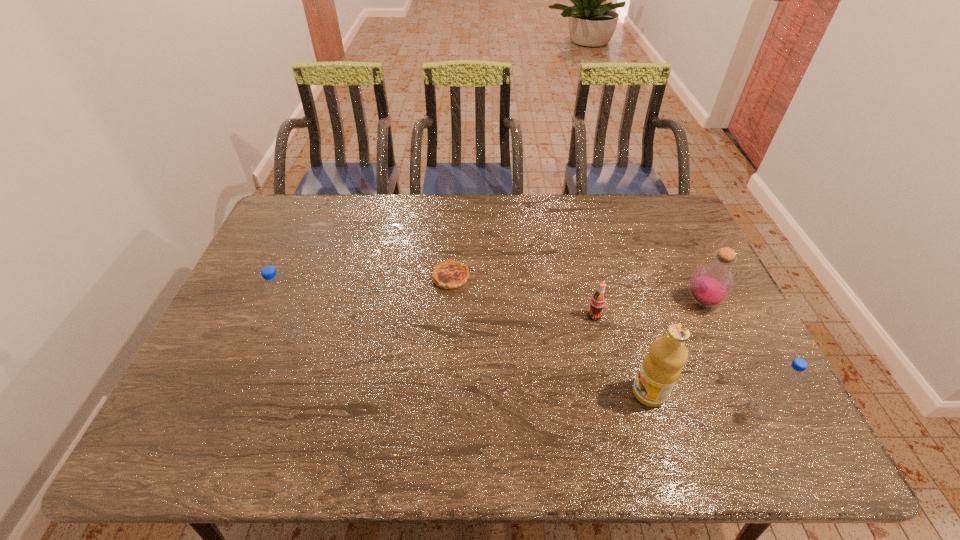
Where is `water bottle located in the right edge section of the desktop`? water bottle located in the right edge section of the desktop is located at coordinates (784, 382).

I want to click on bottle present at the right edge, so click(711, 284).

Image resolution: width=960 pixels, height=540 pixels. I want to click on object located in the near right corner section of the desktop, so click(784, 382).

The image size is (960, 540). I want to click on vacant space at the far edge, so click(x=494, y=196).

Find the location of `free space at the near edge`. free space at the near edge is located at coordinates (692, 407).

What are the coordinates of `free location at the left edge` in the screenshot? It's located at (240, 366).

The image size is (960, 540). What are the coordinates of `vacant space at the right edge` in the screenshot? It's located at (660, 238).

In the image, there is a desktop. Find the location of `vacant space at the far left corner`. vacant space at the far left corner is located at coordinates (276, 222).

Locate an element on the screen. The width and height of the screenshot is (960, 540). free spot between the olive oil and the soda is located at coordinates (621, 355).

Locate an element on the screen. free space between the nearer water bottle and the shortest object is located at coordinates (605, 344).